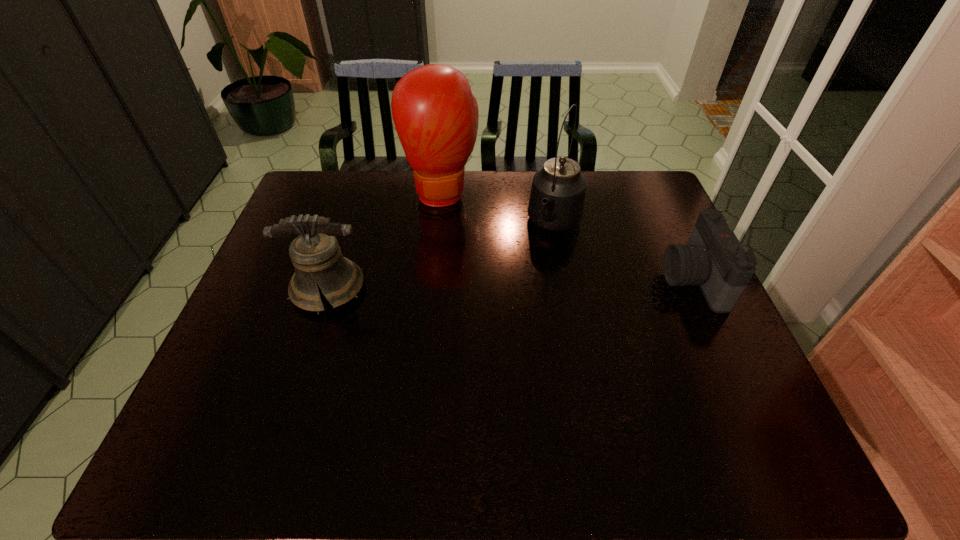
The height and width of the screenshot is (540, 960). In order to click on bell in this screenshot , I will do `click(316, 256)`.

In order to click on the second shortest object in this screenshot , I will do `click(316, 256)`.

Identify the location of the rightmost object. (713, 258).

Where is `the shortest object`? the shortest object is located at coordinates (713, 258).

Locate an element on the screen. The image size is (960, 540). kettle is located at coordinates (557, 198).

What are the coordinates of `the third object from right to left` in the screenshot? It's located at (435, 114).

You are a GUI agent. You are given a task and a screenshot of the screen. Output one action in this format:
    pyautogui.click(x=<x>, y=<y>)
    Task: Click on the vacant space located 0.100m on the back of the second shortest object
    
    Given the screenshot: What is the action you would take?
    pyautogui.click(x=345, y=239)

You are a GUI agent. You are given a task and a screenshot of the screen. Output one action in this format:
    pyautogui.click(x=<x>, y=<y>)
    Task: Click on the vacant space located at the lens of the camera
    
    Given the screenshot: What is the action you would take?
    pyautogui.click(x=632, y=279)

This screenshot has height=540, width=960. I want to click on free space located at the lens of the camera, so click(x=599, y=279).

In order to click on vacant space located 0.240m at the lens of the camera in this screenshot , I will do `click(577, 279)`.